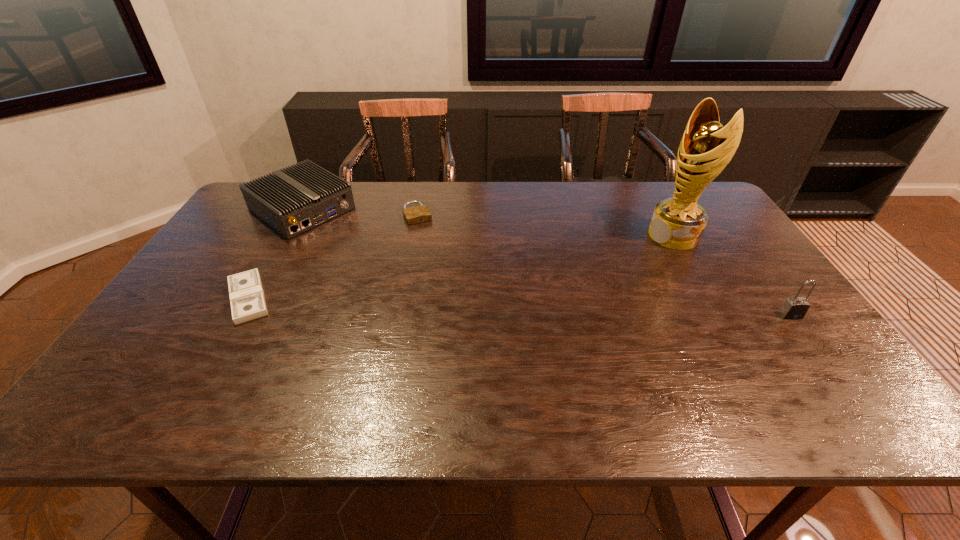
Find the location of a particular element. the shortest object is located at coordinates (247, 300).

Identify the location of the rightmost object. (796, 307).

Find the location of a particular element. The height and width of the screenshot is (540, 960). the taller padlock is located at coordinates (796, 307).

Locate an element on the screen. the third shortest object is located at coordinates (294, 200).

The image size is (960, 540). What are the coordinates of `award` in the screenshot? It's located at (706, 147).

Locate an element on the screen. The height and width of the screenshot is (540, 960). the second object from right to left is located at coordinates (706, 147).

Identify the location of the left padlock. (417, 214).

The image size is (960, 540). Find the location of `the second shortest object`. the second shortest object is located at coordinates (417, 214).

This screenshot has height=540, width=960. Identify the location of vacant space situated on the back of the shortest object. (284, 234).

Where is `vacant space located on the shackle of the nearer padlock`? vacant space located on the shackle of the nearer padlock is located at coordinates (819, 354).